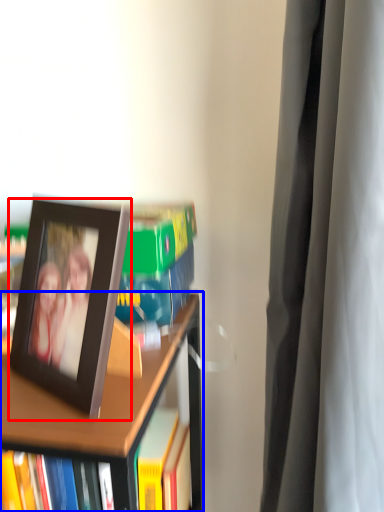
Question: Which of the following is the closest to the observer, picture frame (highlighted by a red box) or bookcase (highlighted by a blue box)?

Choices:
 (A) picture frame
 (B) bookcase

Answer: (A)